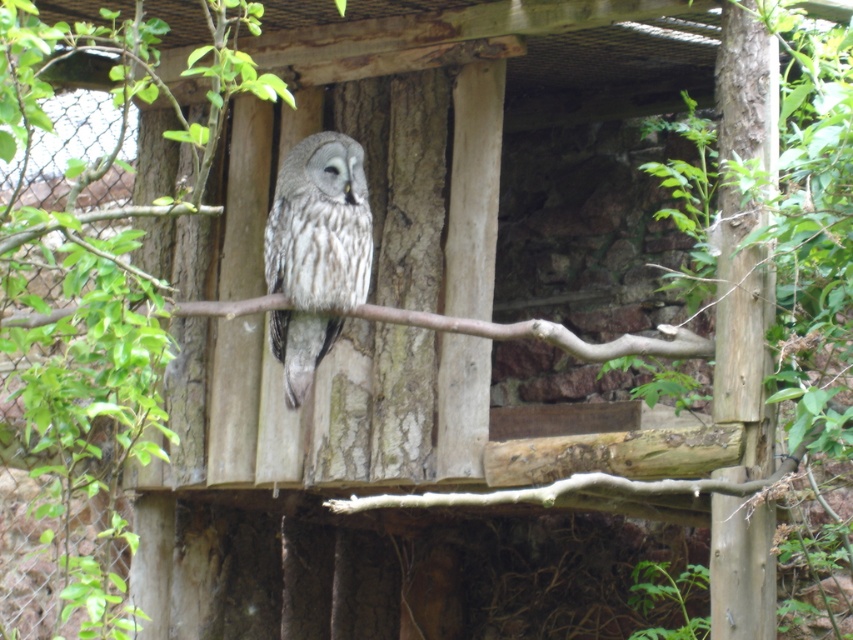
Who is taller, smooth brown wood at right or speckled feathered owl at center?

Standing taller between the two is smooth brown wood at right.

Is smooth brown wood at right closer to the viewer compared to speckled feathered owl at center?

Yes, it is.

Is point (728, 64) positioned before point (280, 209)?

Yes, point (728, 64) is closer to viewer.

Identify the location of smooth brown wood at right. (741, 337).